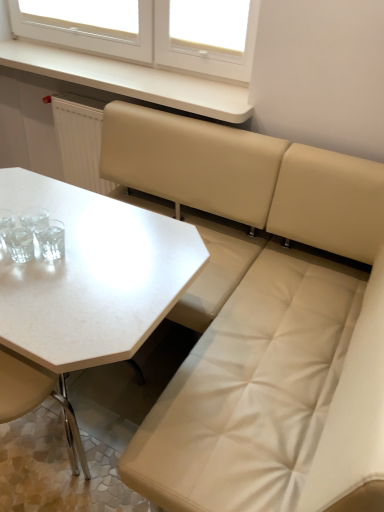
Question: Is white matte counter top at upper center situated inside white matte table at center or outside?

Choices:
 (A) outside
 (B) inside

Answer: (A)

Question: From a real-world perspective, relative to white matte table at center, is white matte counter top at upper center vertically above or below?

Choices:
 (A) above
 (B) below

Answer: (A)

Question: Estimate the real-world distances between objects in this image. Which object is closer to the white matte counter top at upper center?

Choices:
 (A) beige leather chair at lower left
 (B) white matte table at center
 (C) transparent plastic at upper center

Answer: (C)

Question: Estimate the real-world distances between objects in this image. Which object is farther from the transparent plastic at upper center?

Choices:
 (A) white matte table at center
 (B) beige leather chair at lower left
 (C) white matte counter top at upper center

Answer: (B)